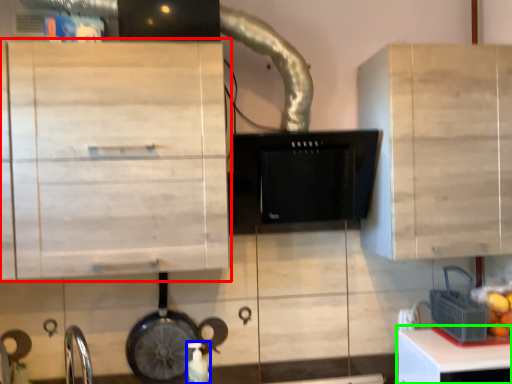
Question: Considering the real-world distances, which object is farthest from cabinetry (highlighted by a red box)? bottle (highlighted by a blue box) or table (highlighted by a green box)?

Choices:
 (A) bottle
 (B) table

Answer: (B)